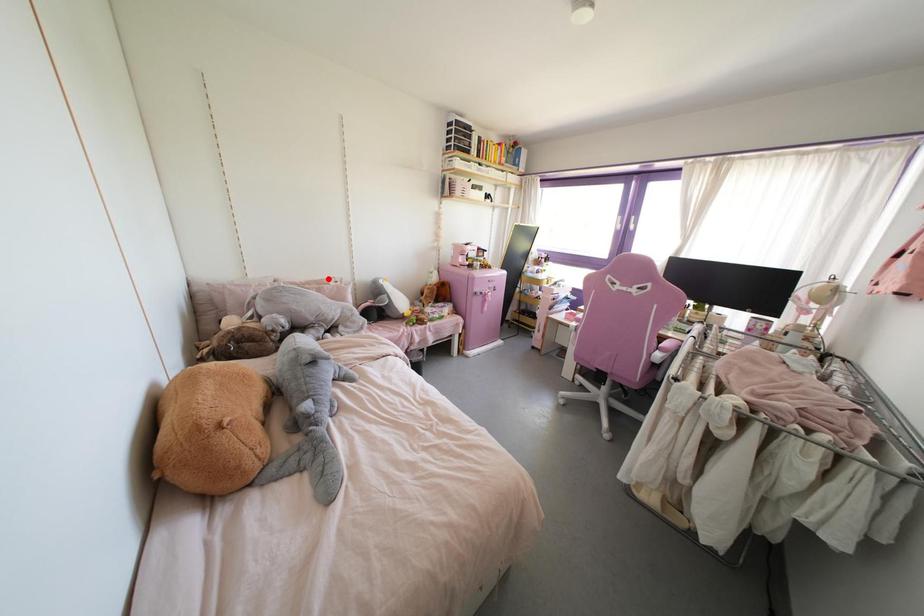
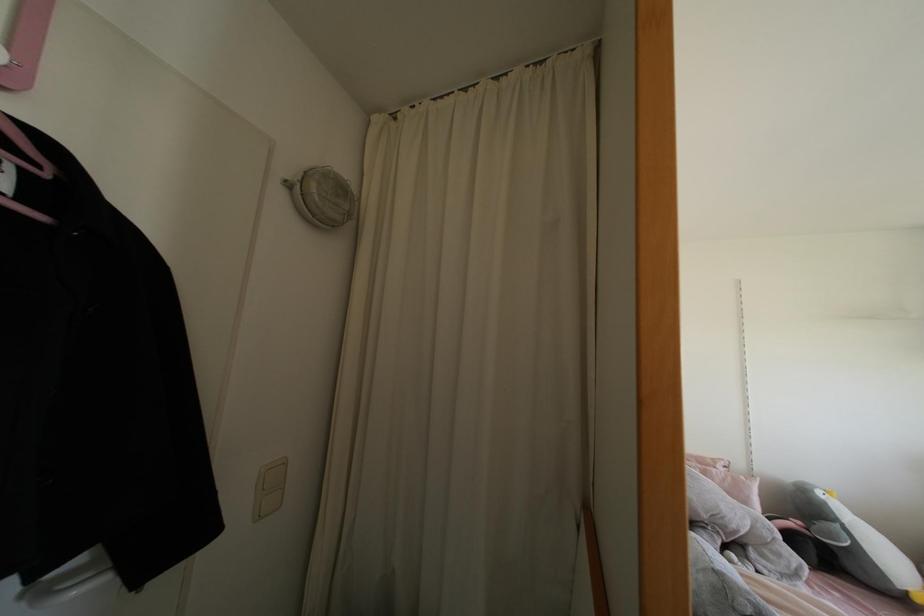
Find the pixel in the second image that matches the highlighted location in the first image.

(712, 460)